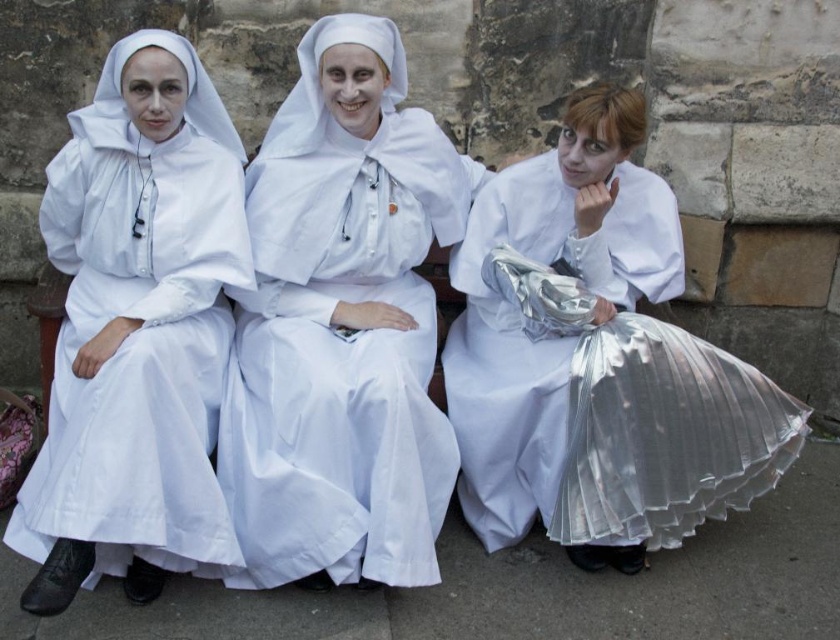
Who is lower down, white matte nun's habit at center or white matte nun's habit at left?

white matte nun's habit at left is below.

Who is more distant from viewer, (421, 122) or (155, 172)?

The point (421, 122) is behind.

Who is more distant from viewer, (287,122) or (56,531)?

The point (287,122) is more distant.

Find the location of a particular element. white matte nun's habit at center is located at coordinates (342, 324).

Is shiny metallic skirt at center positioned in front of white matte nun's habit at left?

No, shiny metallic skirt at center is behind white matte nun's habit at left.

How much distance is there between shiny metallic skirt at center and white matte nun's habit at left?

A distance of 4.20 feet exists between shiny metallic skirt at center and white matte nun's habit at left.

What do you see at coordinates (596, 358) in the screenshot?
I see `shiny metallic skirt at center` at bounding box center [596, 358].

Locate an element on the screen. The image size is (840, 640). shiny metallic skirt at center is located at coordinates (596, 358).

Which is more to the left, white matte nun's habit at center or shiny metallic skirt at center?

white matte nun's habit at center

Which is in front, point (239, 484) or point (512, 252)?

Point (239, 484)

Identify the location of white matte nun's habit at center. (342, 324).